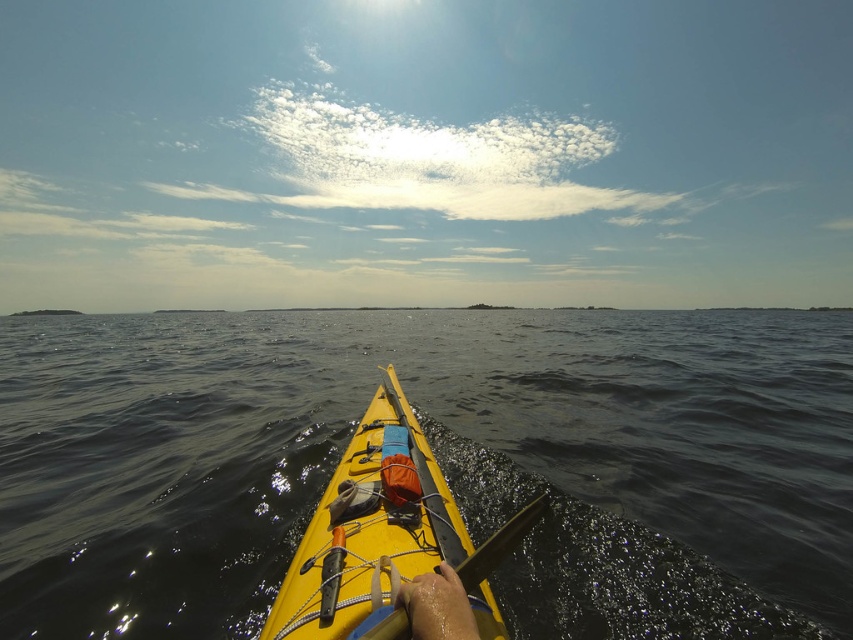
Question: Can you confirm if yellow matte kayak at center is thinner than smooth wood paddle at center?

Choices:
 (A) yes
 (B) no

Answer: (B)

Question: Estimate the real-world distances between objects in this image. Which object is farther from the yellow matte kayak at center?

Choices:
 (A) dark blue water at center
 (B) smooth wood paddle at center

Answer: (A)

Question: Is yellow matte kayak at center positioned before smooth wood paddle at center?

Choices:
 (A) yes
 (B) no

Answer: (A)

Question: Which is nearer to the smooth wood paddle at center?

Choices:
 (A) yellow matte kayak at center
 (B) dark blue water at center

Answer: (A)

Question: Which object is farther from the camera taking this photo?

Choices:
 (A) smooth wood paddle at center
 (B) dark blue water at center

Answer: (B)

Question: From the image, what is the correct spatial relationship of dark blue water at center in relation to yellow matte kayak at center?

Choices:
 (A) above
 (B) below

Answer: (B)